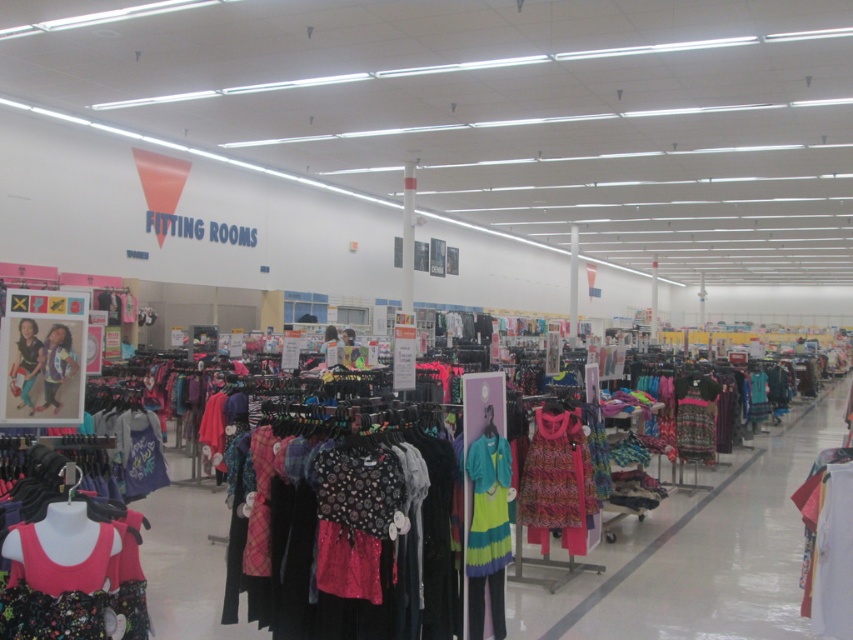
Who is more distant from viewer, (44, 556) or (28, 360)?

Point (28, 360)

Can you confirm if floral fabric dress at lower left is bigger than matte pink dress at center?

Indeed, floral fabric dress at lower left has a larger size compared to matte pink dress at center.

Between point (113, 560) and point (30, 339), which one is positioned behind?

Positioned behind is point (30, 339).

Image resolution: width=853 pixels, height=640 pixels. I want to click on floral fabric dress at lower left, so click(x=68, y=580).

Between printed cotton dress at center and matte black dress at center, which one appears on the right side from the viewer's perspective?

From the viewer's perspective, printed cotton dress at center appears more on the right side.

Identify the location of printed cotton dress at center. (556, 481).

Can you confirm if matte black dress at center is smaller than matte pink dress at center?

Incorrect, matte black dress at center is not smaller in size than matte pink dress at center.

Can you confirm if matte black dress at center is positioned above matte pink dress at center?

No, matte black dress at center is not above matte pink dress at center.

Is point (68, 339) closer to camera compared to point (20, 381)?

No.

Find the location of a particular element. Image resolution: width=853 pixels, height=640 pixels. matte black dress at center is located at coordinates (55, 368).